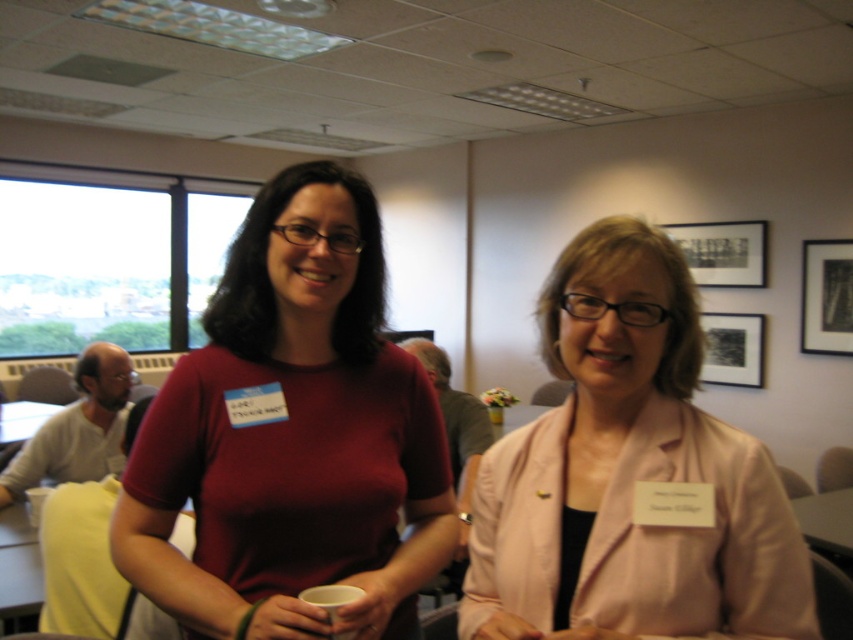
You are a photographer who needs to adjust the camera focus to ensure both the matte red shirt at center and the pink fabric jacket at center are in focus. Given their height difference, which object should you focus on first to ensure both are sharp?

The matte red shirt at center is much taller than the pink fabric jacket at center. To ensure both are in focus, you should focus on the taller object first, which is the matte red shirt at center, as focusing on the farther object first allows the depth of field to cover the closer one.

You are organizing a photo shoot and need to ensure that the two central subjects, the matte red shirt at center and the pink fabric jacket at center, are framed appropriately. Based on their sizes, which clothing item would require more horizontal space in the frame?

The matte red shirt at center requires more horizontal space in the frame because its width is larger than the pink fabric jacket at center.

You are standing in a conference room and see the matte red shirt at center. Can you estimate its position using a coordinate system where the bottom left corner is the origin?

The matte red shirt at center is located at coordinates approximately 0.680 on the x axis and 0.342 on the y axis.